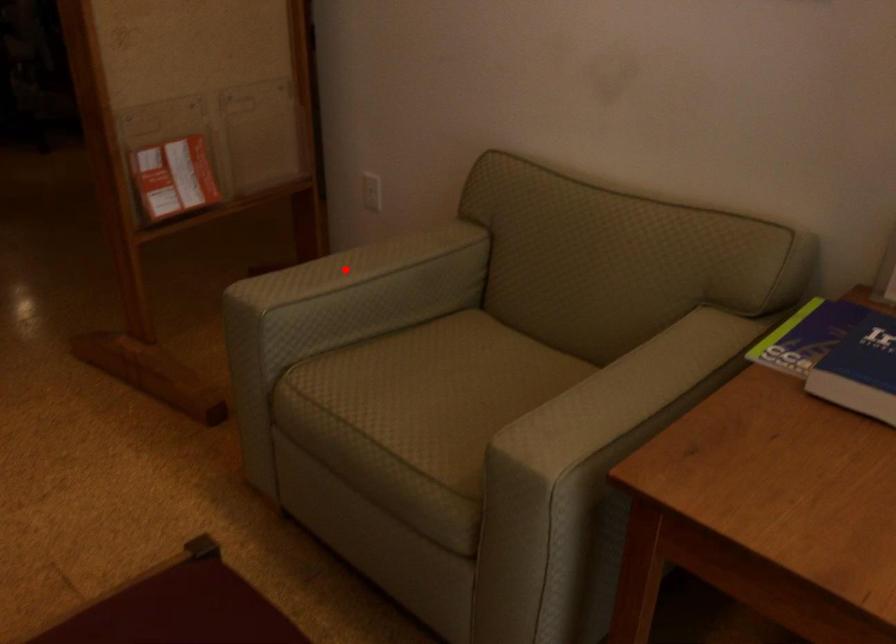
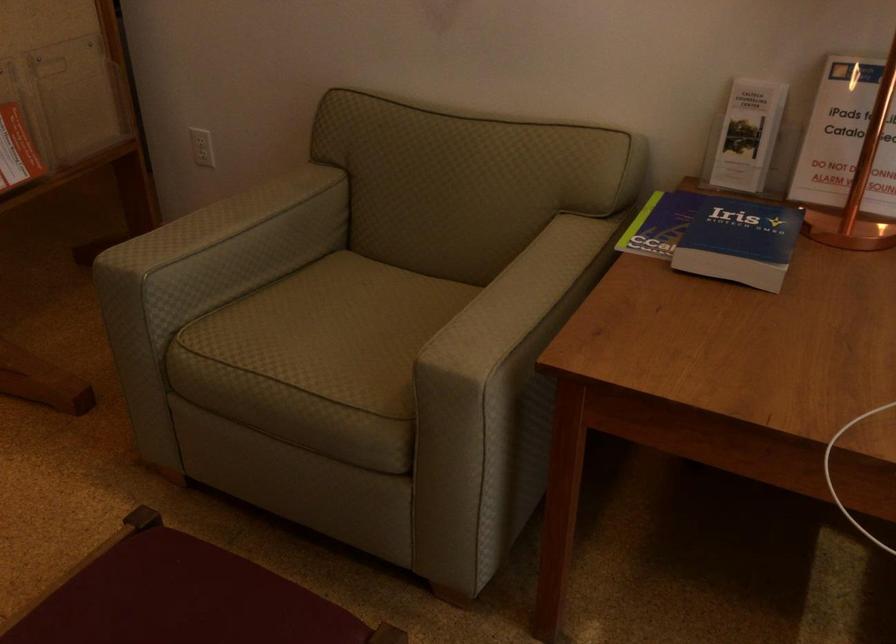
In the second image, find the point that corresponds to the highlighted location in the first image.

(219, 222)